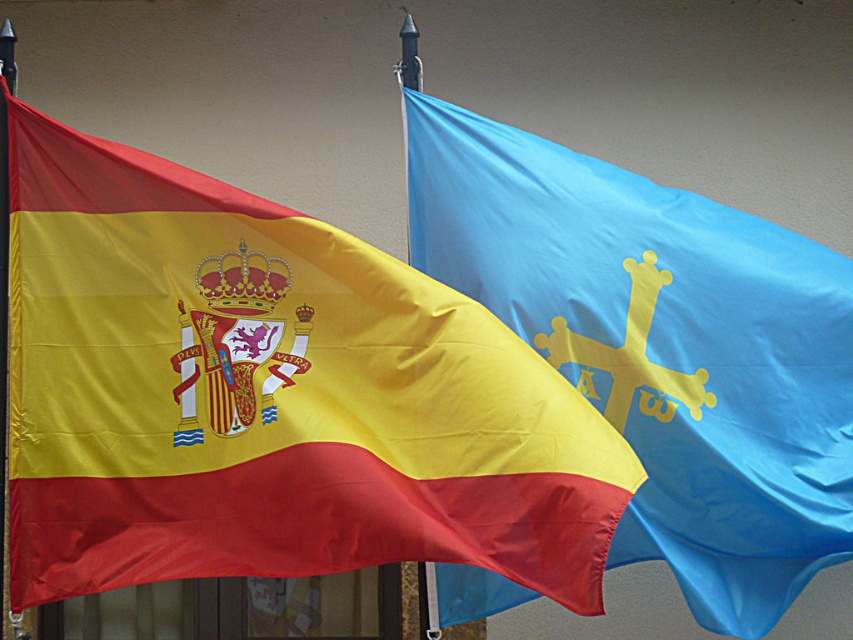
Question: Is matte blue flag with yellow cross at right bigger than metallic pole at left?

Choices:
 (A) yes
 (B) no

Answer: (A)

Question: Which is farther from the metallic pole at left?

Choices:
 (A) matte fabric flag at left
 (B) matte blue flag with yellow cross at right

Answer: (B)

Question: Is matte fabric flag at left to the right of matte blue flag with yellow cross at right from the viewer's perspective?

Choices:
 (A) yes
 (B) no

Answer: (B)

Question: Based on their relative distances, which object is farther from the matte blue flag with yellow cross at right?

Choices:
 (A) metallic pole at left
 (B) matte fabric flag at left

Answer: (A)

Question: Can you confirm if matte blue flag with yellow cross at right is thinner than metallic pole at left?

Choices:
 (A) yes
 (B) no

Answer: (B)

Question: Which object is positioned farthest from the metallic pole at left?

Choices:
 (A) matte blue flag with yellow cross at right
 (B) matte fabric flag at left

Answer: (A)